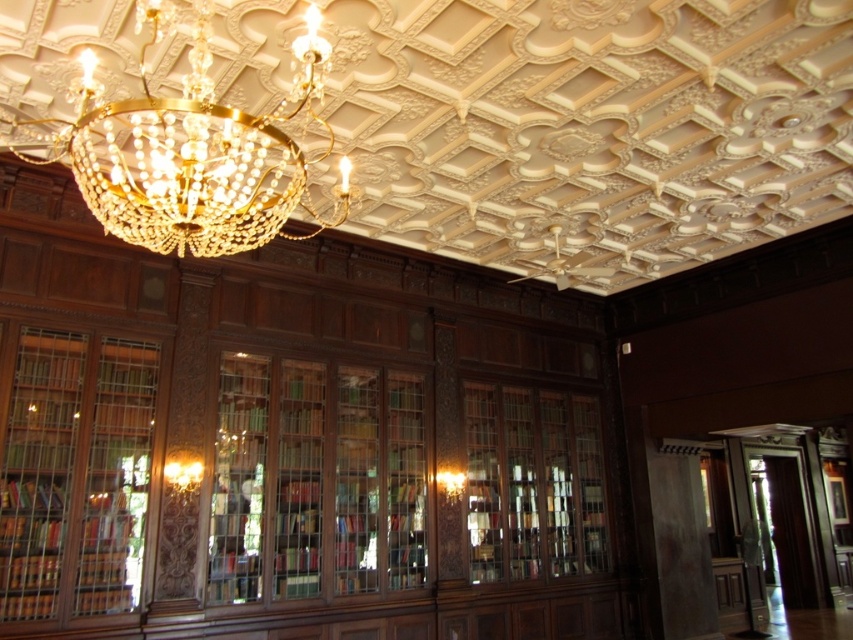
You are an interior designer planning to install a new lighting fixture in the library. The wooden bookcase at left is 2 meters wide. What is the minimum width your new fixture should be to ensure it is wider than the gold crystal chandelier at upper center?

The gold crystal chandelier at upper center is wider than the wooden bookcase at left, which is 2 meters wide. Therefore, the new fixture must be wider than 2 meters to surpass the chandelier.

You are standing in the library and want to touch both points marked in the image. Which point should you reach for first, point (231, 243) or point (3, 609)?

You should reach for point (231, 243) first because it is closer to you than point (3, 609).

You are an interior designer assessing the placement of a new artwork. The artwork will be hung at point coordinates point (189, 150). What object is located at this point?

The point (189, 150) is on the gold crystal chandelier at upper center.